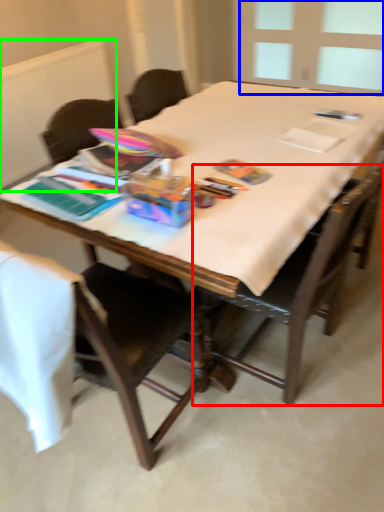
Question: Which object is positioned farthest from chair (highlighted by a red box)? Select from window screen (highlighted by a blue box) and radiator (highlighted by a green box).

Choices:
 (A) window screen
 (B) radiator

Answer: (A)